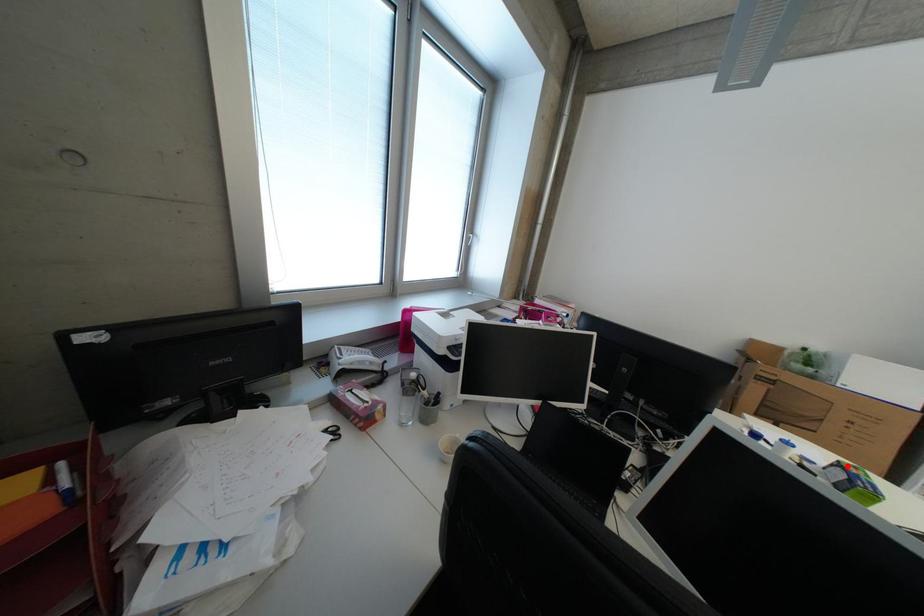
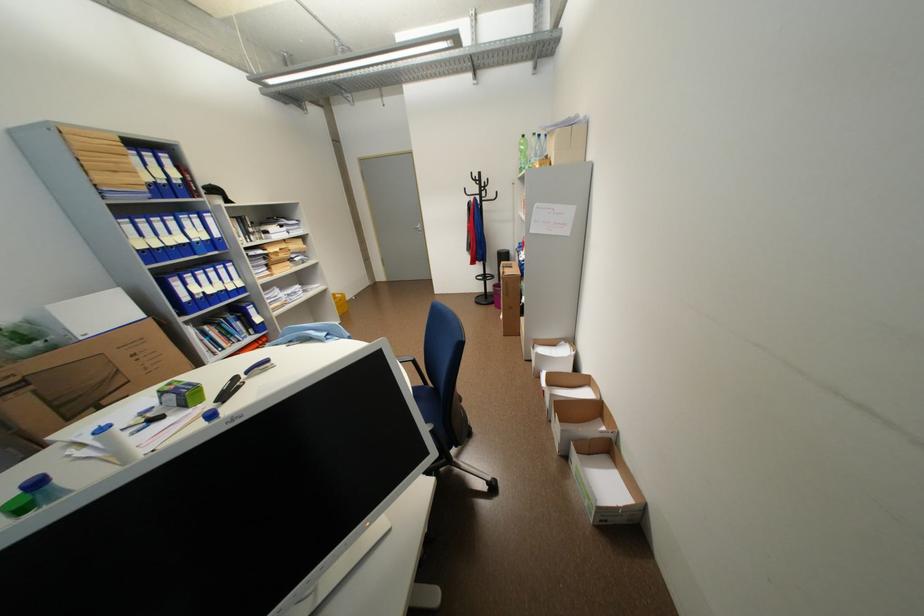
Question: I am providing you with two images of the same scene from different viewpoints. A red point is shown in image1. For the corresponding object point in image2, is it positioned nearer or farther from the camera?

Choices:
 (A) Nearer
 (B) Farther

Answer: (B)